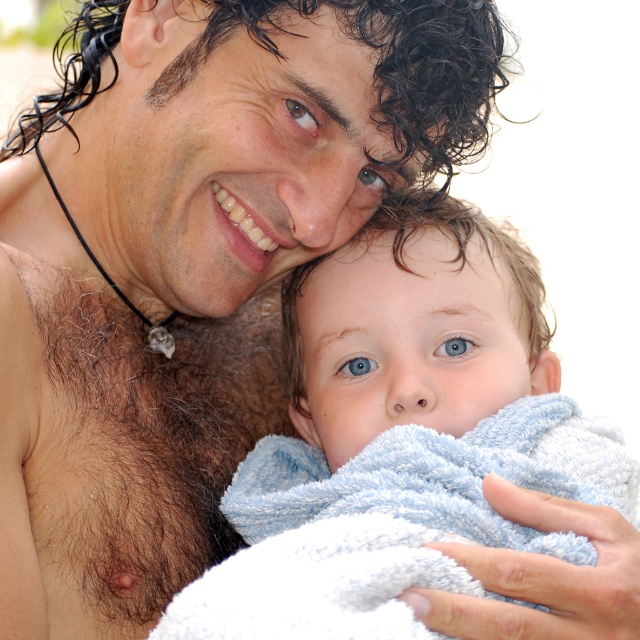
Does blue soft towel at center appear under hairy skin at left?

Correct, blue soft towel at center is located below hairy skin at left.

Between blue soft towel at center and hairy skin at left, which one appears on the right side from the viewer's perspective?

From the viewer's perspective, blue soft towel at center appears more on the right side.

Identify the location of blue soft towel at center. The width and height of the screenshot is (640, 640). (401, 433).

This screenshot has height=640, width=640. In order to click on blue soft towel at center in this screenshot , I will do `click(401, 433)`.